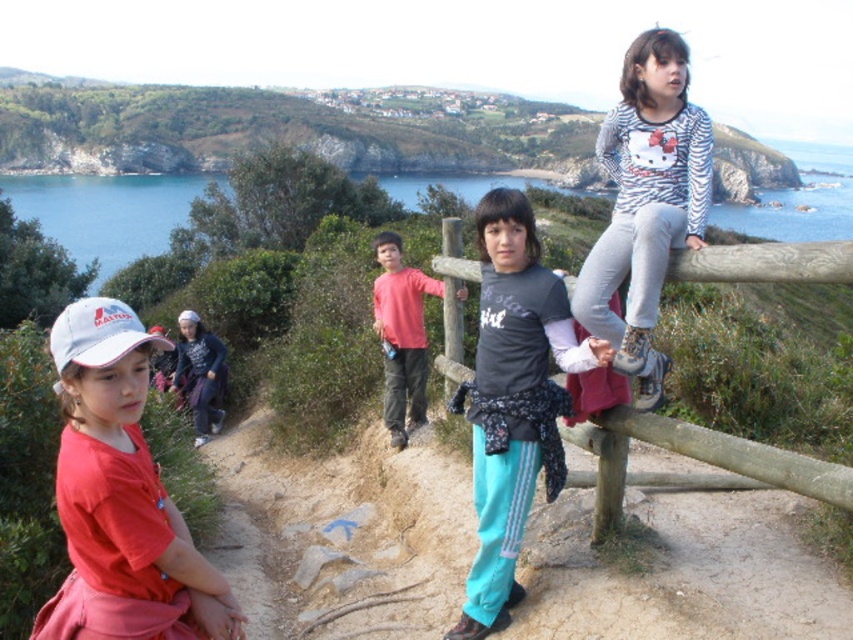
Which is more to the right, green grassy hillside at upper center or striped cotton shirt at upper right?

striped cotton shirt at upper right

Can you confirm if green grassy hillside at upper center is shorter than striped cotton shirt at upper right?

In fact, green grassy hillside at upper center may be taller than striped cotton shirt at upper right.

Which is behind, point (454, 100) or point (660, 80)?

Positioned behind is point (454, 100).

Where is `green grassy hillside at upper center`? green grassy hillside at upper center is located at coordinates (283, 129).

Which of these two, striped cotton shirt at upper right or wooden at center, stands shorter?

Standing shorter between the two is wooden at center.

Which is more to the left, striped cotton shirt at upper right or wooden at center?

From the viewer's perspective, wooden at center appears more on the left side.

Measure the distance between striped cotton shirt at upper right and camera.

striped cotton shirt at upper right is 8.58 meters from camera.

Where is `striped cotton shirt at upper right`? striped cotton shirt at upper right is located at coordinates (646, 202).

Based on the photo, can you confirm if dark gray shirt at center is positioned below matte red shirt at center?

Actually, dark gray shirt at center is above matte red shirt at center.

Is dark gray shirt at center shorter than matte red shirt at center?

Incorrect, dark gray shirt at center's height does not fall short of matte red shirt at center's.

I want to click on dark gray shirt at center, so click(514, 400).